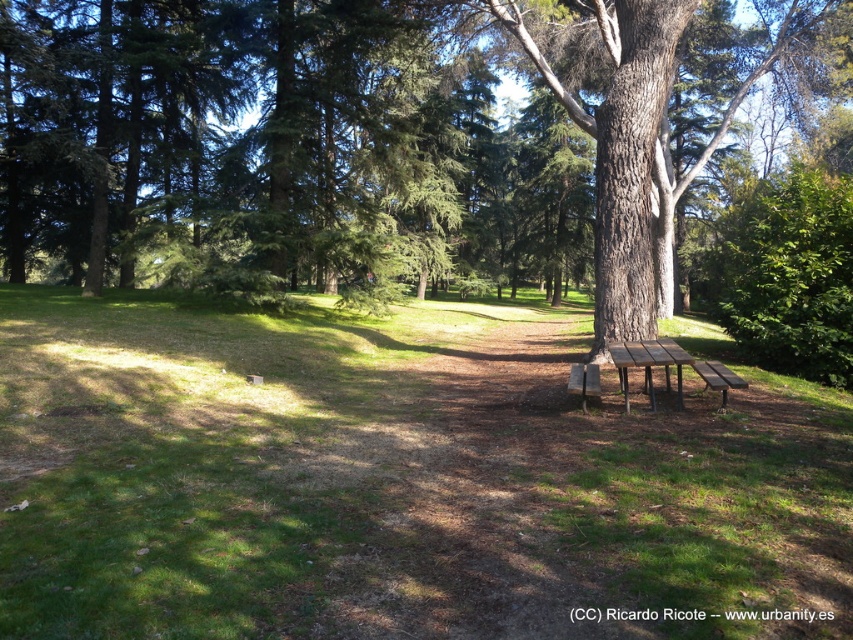
Question: Does green grassy at center have a larger size compared to wooden park bench at center?

Choices:
 (A) yes
 (B) no

Answer: (A)

Question: Which object is the farthest from the wooden park bench at right?

Choices:
 (A) wooden picnic table at lower right
 (B) green grassy at center

Answer: (B)

Question: Which object is closer to the camera taking this photo?

Choices:
 (A) wooden park bench at right
 (B) wooden picnic table at lower right

Answer: (A)

Question: Which point is closer to the camera?

Choices:
 (A) green grassy at center
 (B) wooden park bench at right
 (C) brown wood tree at center

Answer: (A)

Question: Is wooden picnic table at lower right further to the viewer compared to wooden park bench at center?

Choices:
 (A) no
 (B) yes

Answer: (A)

Question: Does brown wood tree at center have a lesser width compared to wooden park bench at center?

Choices:
 (A) no
 (B) yes

Answer: (A)